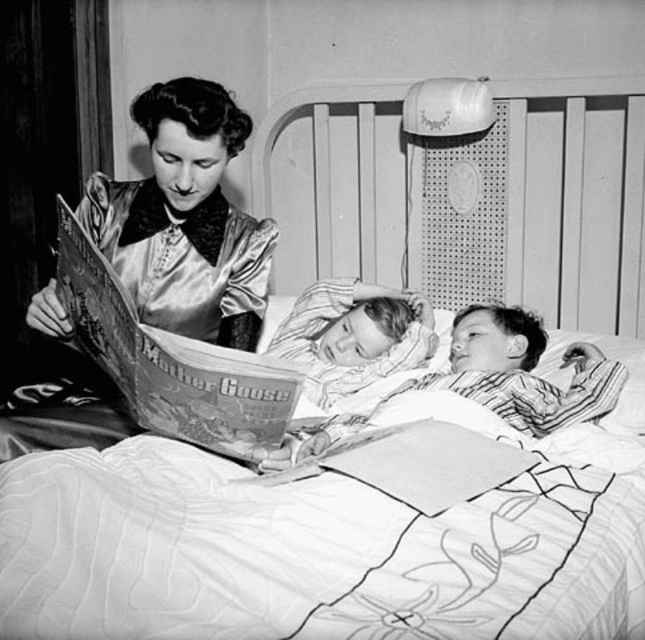
Can you confirm if silky satin dress at upper left is thinner than smooth fabric pillow at center?

In fact, silky satin dress at upper left might be wider than smooth fabric pillow at center.

This screenshot has width=645, height=640. What do you see at coordinates (184, 218) in the screenshot? I see `silky satin dress at upper left` at bounding box center [184, 218].

At what (x,y) coordinates should I click in order to perform the action: click on silky satin dress at upper left. Please return your answer as a coordinate pair (x, y). The image size is (645, 640). Looking at the image, I should click on (184, 218).

Can you confirm if printed paper book at left is thinner than smooth fabric pillow at center?

No, printed paper book at left is not thinner than smooth fabric pillow at center.

Can you confirm if printed paper book at left is positioned above smooth fabric pillow at center?

No, printed paper book at left is not above smooth fabric pillow at center.

At what (x,y) coordinates should I click in order to perform the action: click on printed paper book at left. Please return your answer as a coordinate pair (x, y). Looking at the image, I should click on (174, 364).

Image resolution: width=645 pixels, height=640 pixels. I want to click on printed paper book at left, so click(x=174, y=364).

This screenshot has width=645, height=640. Identify the location of silky satin dress at upper left. (184, 218).

Does silky satin dress at upper left have a greater height compared to printed paper book at left?

Yes.

Does point (210, 106) come behind point (72, 228)?

Yes, it is behind point (72, 228).

In order to click on silky satin dress at upper left in this screenshot , I will do `click(184, 218)`.